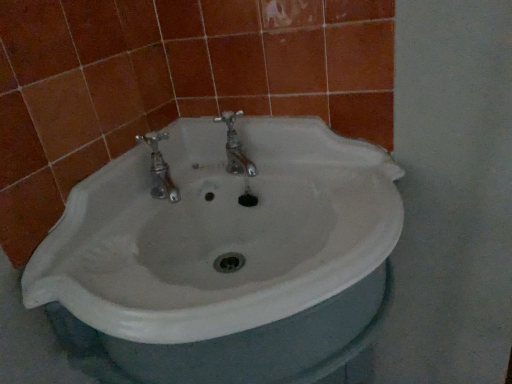
What do you see at coordinates (219, 229) in the screenshot?
I see `white ceramic sink at center` at bounding box center [219, 229].

Where is `white ceramic sink at center`? The image size is (512, 384). white ceramic sink at center is located at coordinates (219, 229).

Locate an element on the screen. The image size is (512, 384). white ceramic sink at center is located at coordinates (219, 229).